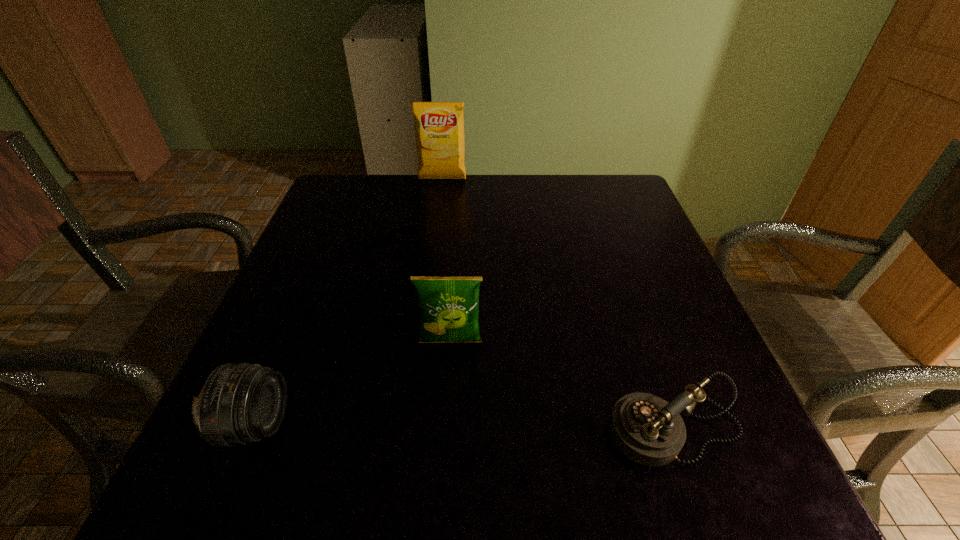
Find the location of a particular element. This screenshot has height=540, width=960. free region that satisfies the following two spatial constraints: 1. on the back side of the rightmost object; 2. at the front element of the leftmost object is located at coordinates (673, 424).

The height and width of the screenshot is (540, 960). In order to click on vacant space that satisfies the following two spatial constraints: 1. on the front of the farther crisp (potato chip) with the logo; 2. on the right side of the telephone in this screenshot , I will do `click(411, 429)`.

I want to click on free space that satisfies the following two spatial constraints: 1. at the front element of the leftmost object; 2. on the right side of the rightmost object, so click(253, 429).

Where is `free region that satisfies the following two spatial constraints: 1. at the front element of the leftmost object; 2. on the right side of the telephone`? free region that satisfies the following two spatial constraints: 1. at the front element of the leftmost object; 2. on the right side of the telephone is located at coordinates (253, 429).

Where is `blank space that satisfies the following two spatial constraints: 1. on the front of the telephone with the logo; 2. on the right side of the tallest object`? The width and height of the screenshot is (960, 540). blank space that satisfies the following two spatial constraints: 1. on the front of the telephone with the logo; 2. on the right side of the tallest object is located at coordinates (411, 429).

Locate an element on the screen. The image size is (960, 540). free space in the image that satisfies the following two spatial constraints: 1. on the front of the farther crisp (potato chip) with the logo; 2. on the right side of the rightmost object is located at coordinates (411, 429).

The width and height of the screenshot is (960, 540). What are the coordinates of `free space that satisfies the following two spatial constraints: 1. at the front element of the leftmost object; 2. on the right side of the telephone` in the screenshot? It's located at (253, 429).

You are a GUI agent. You are given a task and a screenshot of the screen. Output one action in this format:
    pyautogui.click(x=<x>, y=<y>)
    Task: Click on the free space in the image that satisfies the following two spatial constraints: 1. on the front-facing side of the second tallest object; 2. at the front element of the leftmost object
    This screenshot has height=540, width=960.
    Given the screenshot: What is the action you would take?
    pyautogui.click(x=445, y=424)